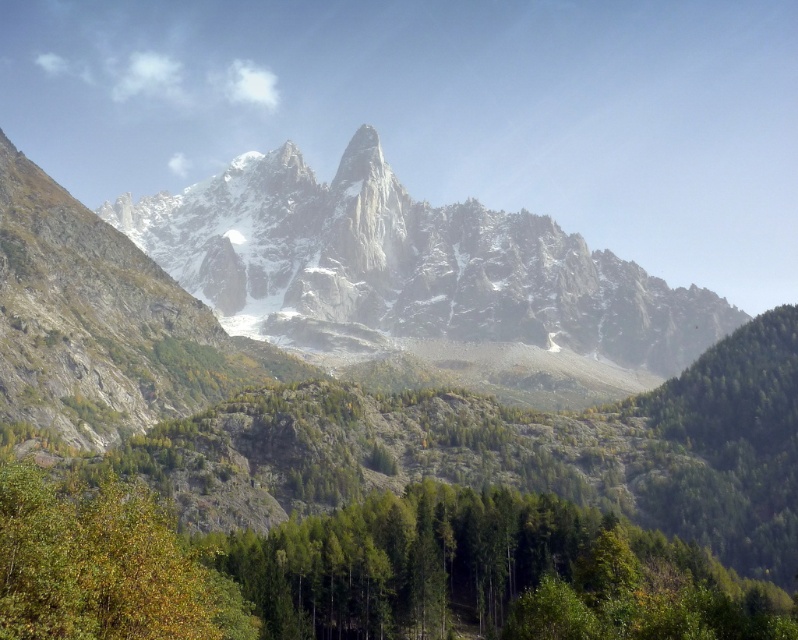
Question: Among these points, which one is nearest to the camera?

Choices:
 (A) (409, 300)
 (B) (85, 570)

Answer: (B)

Question: Can you confirm if white rocky mountain range at center is positioned to the right of green leafy tree at lower left?

Choices:
 (A) yes
 (B) no

Answer: (A)

Question: Does white rocky mountain range at center have a lesser width compared to green leafy tree at lower left?

Choices:
 (A) no
 (B) yes

Answer: (A)

Question: Is white rocky mountain range at center bigger than green leafy tree at lower left?

Choices:
 (A) yes
 (B) no

Answer: (A)

Question: Which point is farther to the camera?

Choices:
 (A) white rocky mountain range at center
 (B) green leafy tree at lower left

Answer: (A)